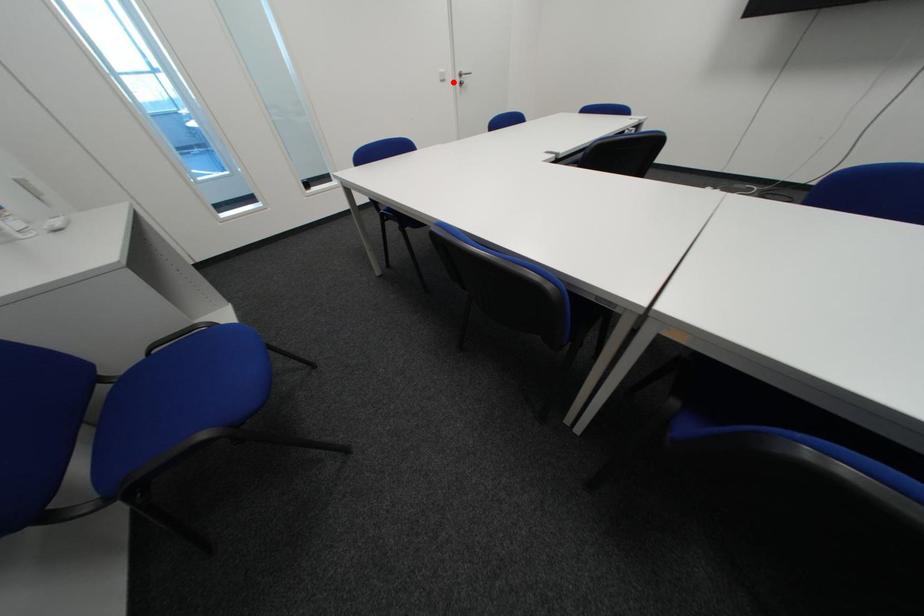
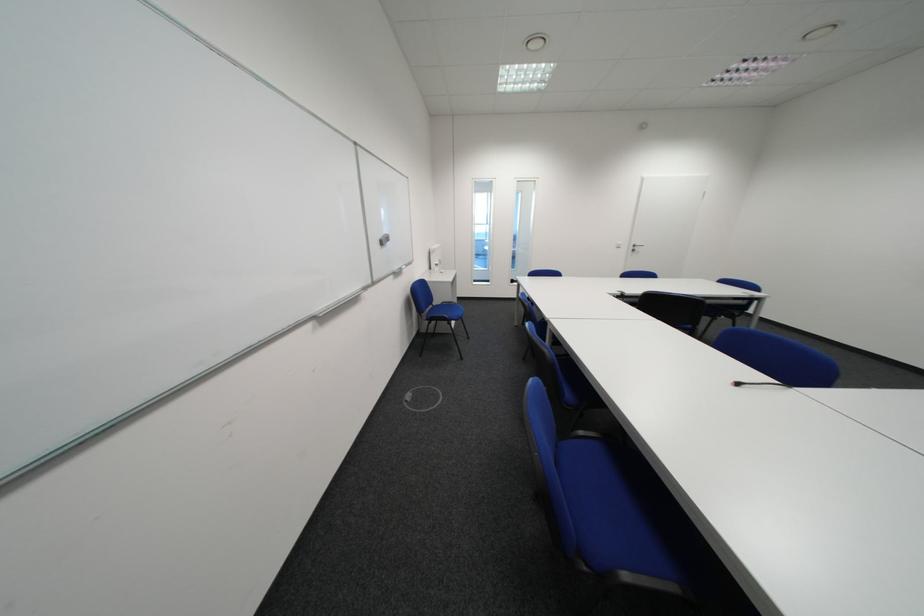
Where in the second image is the point corresponding to the highlighted location from the first image?

(628, 249)